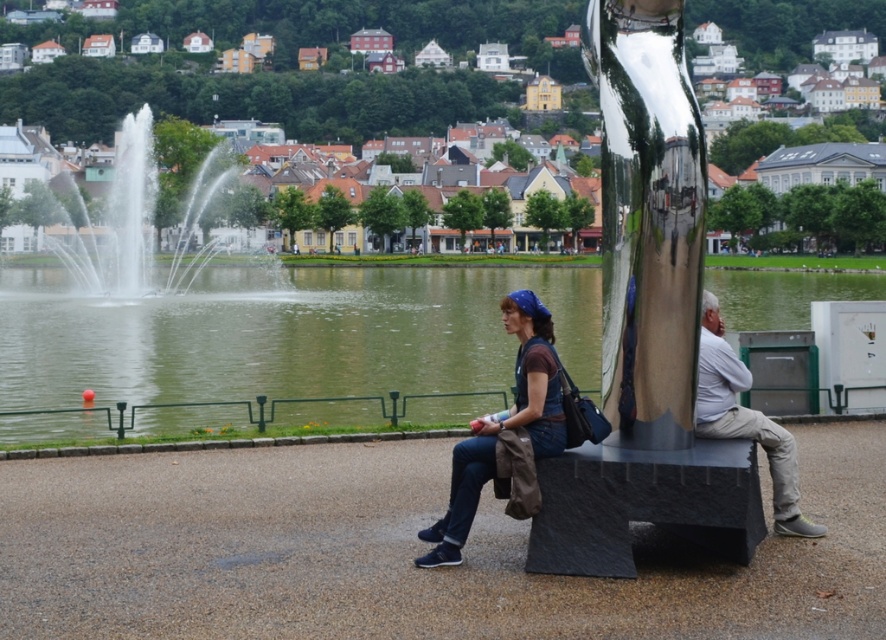
You are a photographer standing in the park and want to capture a photo where the white water at center is clearly visible above the matte black shirt at center. Based on the scene description, can you confirm if this is possible?

Yes, the white water at center is much taller than the matte black shirt at center, so it will be visible above it in the photo.

You are a visitor in the park and want to place a small picnic basket on the black textured bench at lower right without it falling off. Considering the green water at center is above the bench, where should you place the basket on the bench?

You should place the picnic basket on the side of the black textured bench at lower right that is away from the green water at center. Since the water is above the bench, placing it closer to the opposite side would prevent it from sliding off into the water.

You are standing in the park and see the matte black shirt at center and the light gray cotton pants at right. Which object is positioned more to the left?

The matte black shirt at center is positioned more to the left than the light gray cotton pants at right.